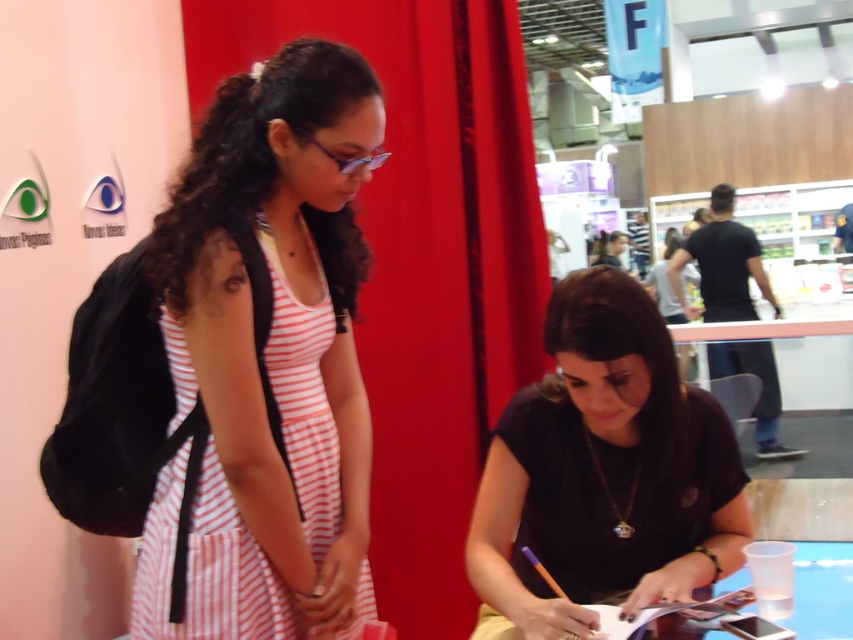
Question: Is pink striped dress at left below black matte shirt at center?

Choices:
 (A) yes
 (B) no

Answer: (B)

Question: Among these points, which one is farthest from the camera?

Choices:
 (A) (181, 176)
 (B) (619, 312)

Answer: (A)

Question: Does pink striped dress at left have a larger size compared to black matte shirt at center?

Choices:
 (A) no
 (B) yes

Answer: (A)

Question: Which point is farther from the camera taking this photo?

Choices:
 (A) (271, 355)
 (B) (548, 618)

Answer: (A)

Question: Does pink striped dress at left have a lesser width compared to black matte shirt at center?

Choices:
 (A) no
 (B) yes

Answer: (B)